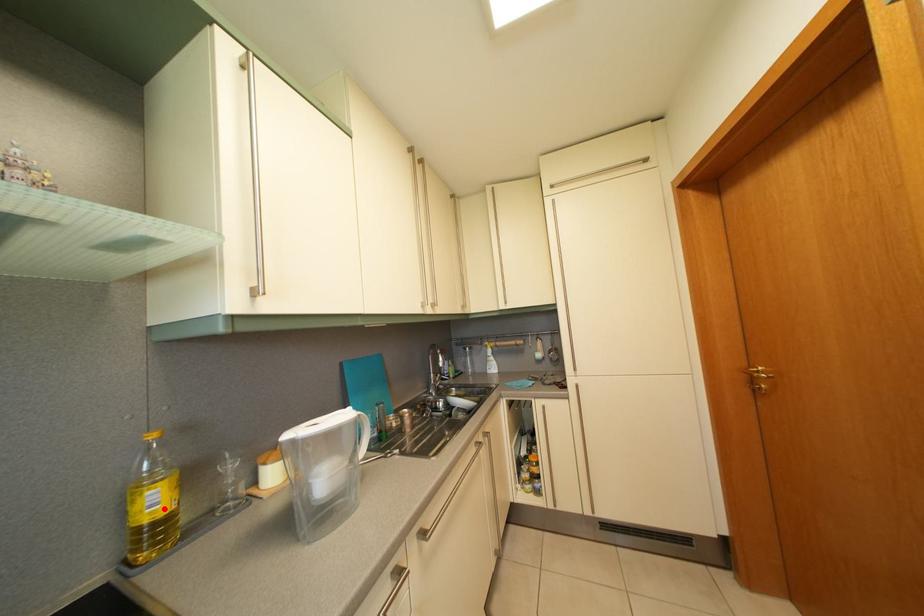
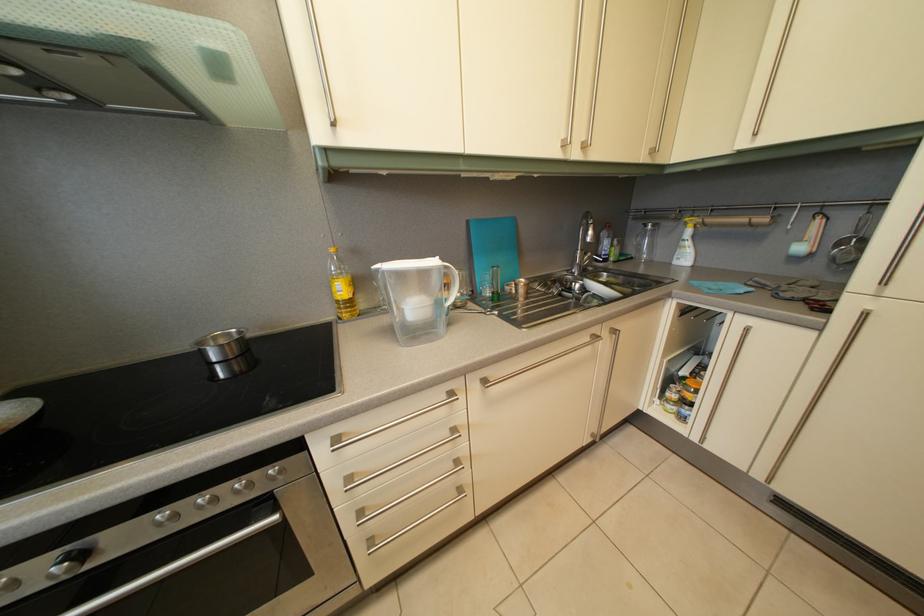
The point at the highlighted location is marked in the first image. Where is the corresponding point in the second image?

(349, 297)